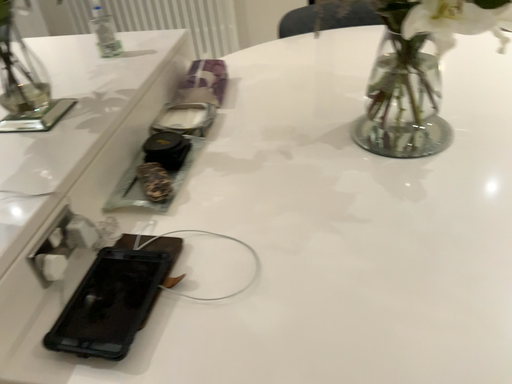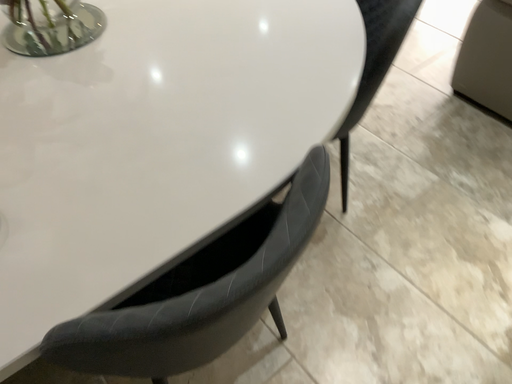
Question: Which way did the camera rotate in the video?

Choices:
 (A) rotated left
 (B) rotated right

Answer: (B)